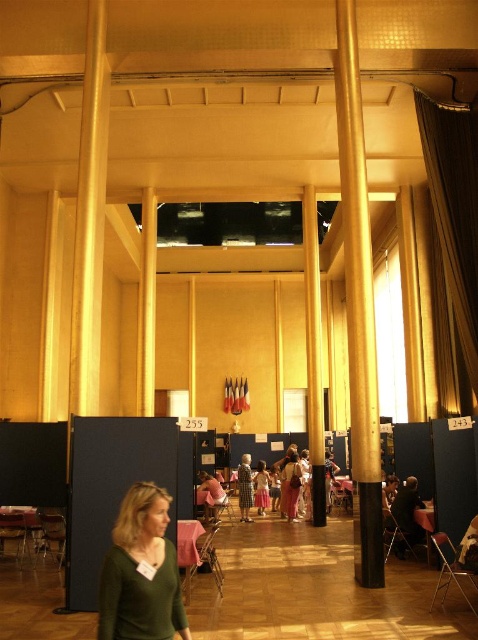
Question: Does gold fabric curtain at right have a smaller size compared to gold polished pillar at center?

Choices:
 (A) yes
 (B) no

Answer: (A)

Question: Can you confirm if green matte sweater at lower left is positioned to the left of plaid fabric dress at center?

Choices:
 (A) yes
 (B) no

Answer: (A)

Question: Does green matte sweater at lower left appear on the right side of gold fabric curtain at right?

Choices:
 (A) yes
 (B) no

Answer: (B)

Question: Which point appears farthest from the camera in this image?

Choices:
 (A) (240, 513)
 (B) (260, 460)
 (C) (361, 524)

Answer: (B)

Question: Which point appears farthest from the camera in this image?

Choices:
 (A) (209, 509)
 (B) (258, 506)
 (C) (453, 272)

Answer: (B)

Question: Which of the following is the farthest from the observer?

Choices:
 (A) (197, 490)
 (B) (315, 435)
 (C) (354, 566)

Answer: (B)